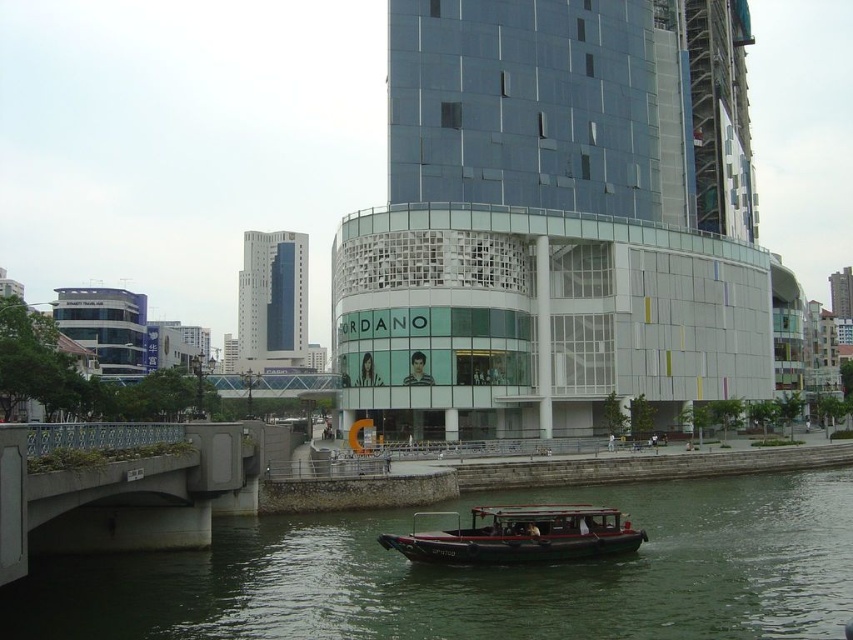
You are a city planner assessing the width of structures in the riverside area. The concrete bridge at lower left and the dark brown wood boat at center are both in your view. Which structure has a narrower width?

The concrete bridge at lower left is thinner than the dark brown wood boat at center, so the concrete bridge at lower left has a narrower width.

You are standing on the riverside walkway and want to take a photo of both the greenish water at lower center and the dark brown wood boat at center. Which object should you focus on first to ensure both are in the frame?

Since the greenish water at lower center is in front of the dark brown wood boat at center, you should focus on the dark brown wood boat at center first to ensure both are in the frame.